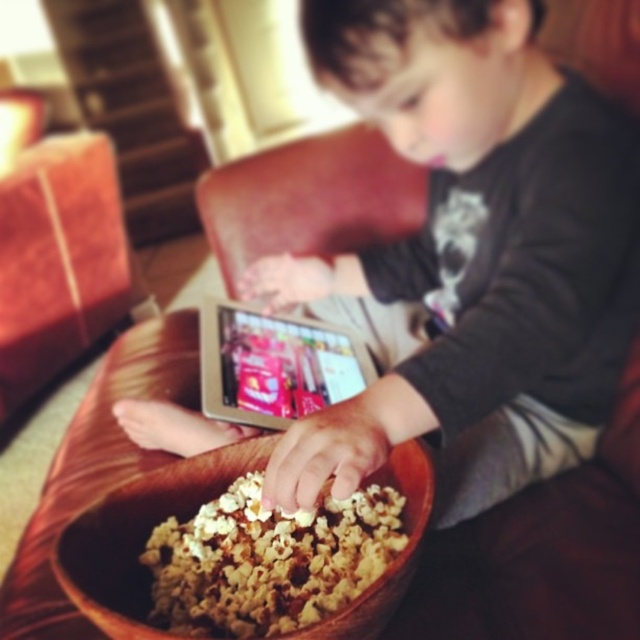
Question: Which of these objects is positioned farthest from the brown textured shirt at center?

Choices:
 (A) crispy brown popcorn at lower center
 (B) silver metallic tablet at center

Answer: (A)

Question: Which point is farther to the camera?

Choices:
 (A) silver metallic tablet at center
 (B) crispy brown popcorn at lower center
 (C) brown textured shirt at center

Answer: (A)

Question: Is brown textured shirt at center bigger than silver metallic tablet at center?

Choices:
 (A) yes
 (B) no

Answer: (A)

Question: Does brown textured shirt at center appear on the left side of crispy brown popcorn at lower center?

Choices:
 (A) yes
 (B) no

Answer: (B)

Question: From the image, what is the correct spatial relationship of brown textured shirt at center in relation to silver metallic tablet at center?

Choices:
 (A) below
 (B) above

Answer: (B)

Question: Which point appears farthest from the camera in this image?

Choices:
 (A) (291, 394)
 (B) (278, 611)

Answer: (A)